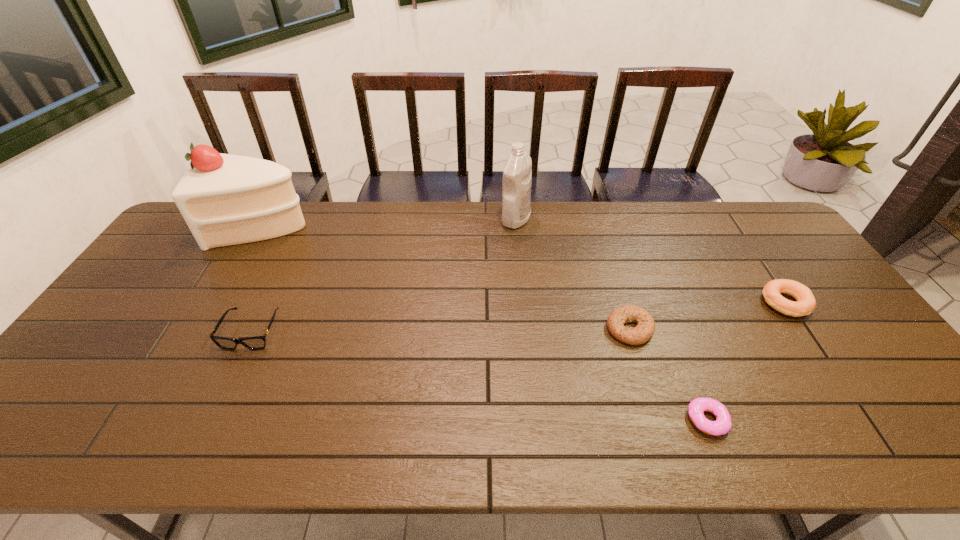
The height and width of the screenshot is (540, 960). I want to click on cake, so click(x=225, y=199).

Locate an element on the screen. The image size is (960, 540). detergent is located at coordinates (517, 173).

Find the location of a particular element. Image resolution: width=960 pixels, height=540 pixels. sunglasses is located at coordinates (255, 342).

Where is `the right bagel`? This screenshot has width=960, height=540. the right bagel is located at coordinates (806, 303).

The image size is (960, 540). Find the location of `the third object from right to left`. the third object from right to left is located at coordinates (645, 328).

Where is `the left bagel`? the left bagel is located at coordinates (645, 328).

The height and width of the screenshot is (540, 960). I want to click on the fifth object from left to right, so click(696, 408).

At what (x,y) coordinates should I click in order to perform the action: click on the shortest object. Please return your answer as a coordinate pair (x, y). Looking at the image, I should click on (696, 408).

Find the location of `free space located 0.170m on the front of the cake`. free space located 0.170m on the front of the cake is located at coordinates (227, 289).

Where is `vacant space located 0.140m on the left of the detergent`? The height and width of the screenshot is (540, 960). vacant space located 0.140m on the left of the detergent is located at coordinates (461, 219).